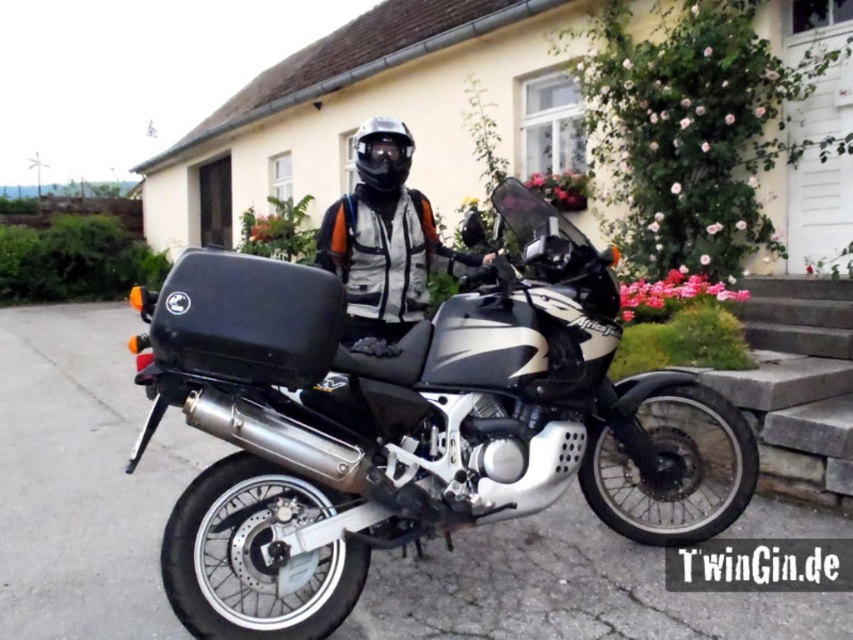
Question: Does matte black helmet at center appear on the left side of transparent plastic goggles at center?

Choices:
 (A) no
 (B) yes

Answer: (A)

Question: Which point is closer to the camera?

Choices:
 (A) matte black helmet at center
 (B) black matte helmet at center

Answer: (A)

Question: Which point appears farthest from the camera in this image?

Choices:
 (A) (337, 243)
 (B) (543, 321)
 (C) (368, 148)
 (D) (381, 173)

Answer: (A)

Question: Which object is farther from the camera taking this photo?

Choices:
 (A) black matte helmet at center
 (B) matte black helmet at center
 (C) transparent plastic goggles at center
 (D) silver metallic motorcycle at center

Answer: (A)

Question: Can you confirm if silver metallic motorcycle at center is positioned above matte black helmet at center?

Choices:
 (A) no
 (B) yes

Answer: (A)

Question: Can you confirm if silver metallic motorcycle at center is positioned above matte black helmet at center?

Choices:
 (A) no
 (B) yes

Answer: (A)